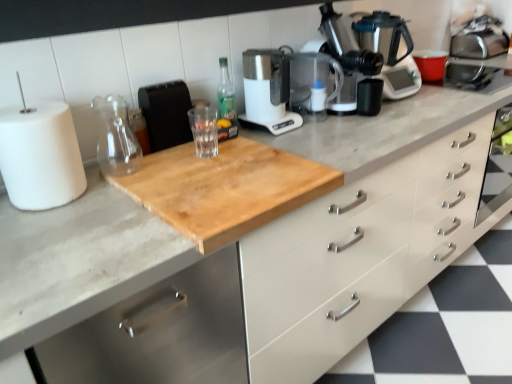
Locate an element on the screen. This screenshot has height=384, width=512. vacant area that is in front of white plastic coffee maker at center is located at coordinates (303, 139).